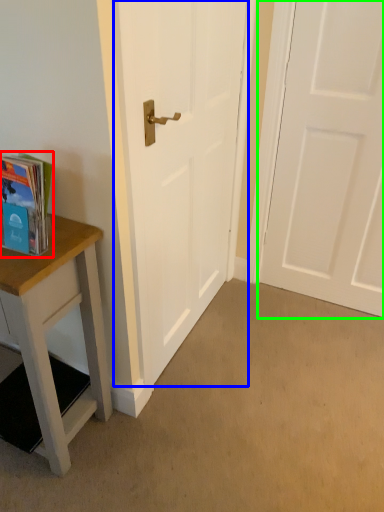
Question: Estimate the real-world distances between objects in this image. Which object is closer to book (highlighted by a red box), door (highlighted by a blue box) or door (highlighted by a green box)?

Choices:
 (A) door
 (B) door

Answer: (A)